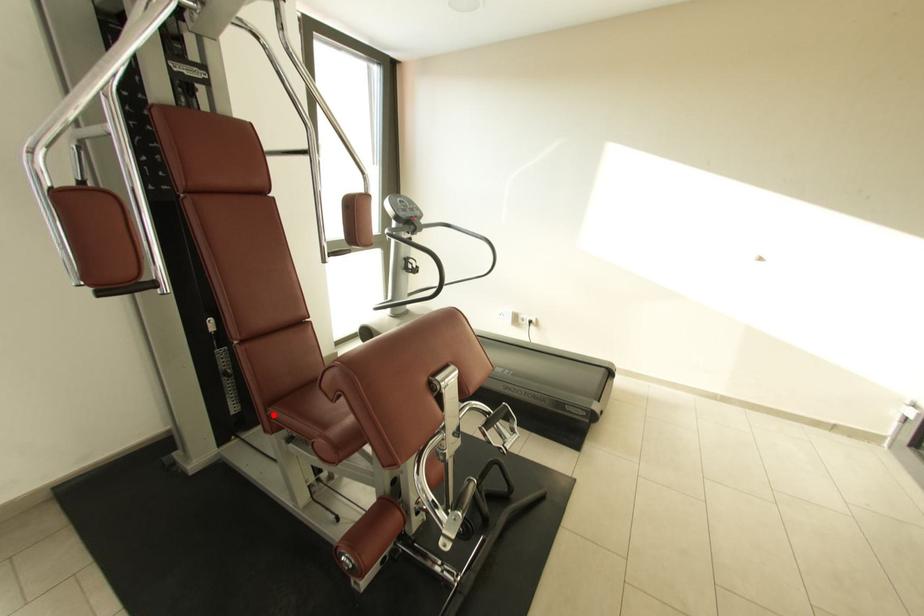
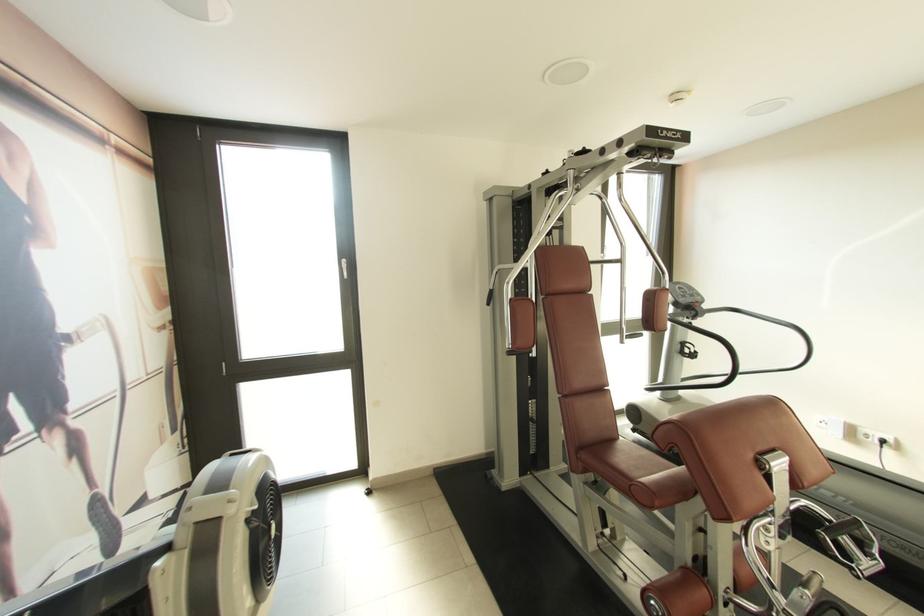
In the second image, find the point that corresponds to the highlighted location in the first image.

(582, 456)